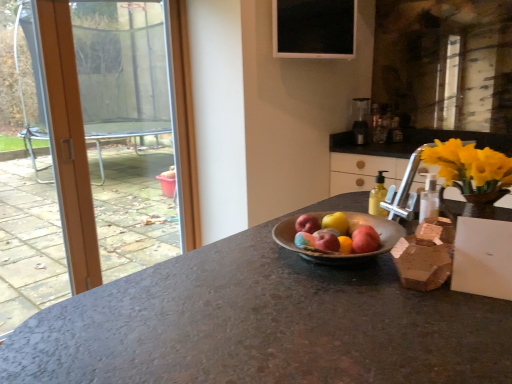
What is the approximate height of transparent glass window at upper left?

transparent glass window at upper left is 1.71 meters tall.

What do you see at coordinates (307, 224) in the screenshot?
I see `matte pink apple at center, acting as the third apple starting from the front` at bounding box center [307, 224].

Locate an element on the screen. Image resolution: width=512 pixels, height=384 pixels. red matte apple at center, which is counted as the second apple, starting from the front is located at coordinates (365, 240).

At what (x,y) coordinates should I click in order to perform the action: click on transparent glass window at upper left. Please return your answer as a coordinate pair (x, y). The image size is (512, 384). Looking at the image, I should click on (114, 134).

From the image's perspective, between matte pink apple at center, the first apple positioned from the front, and red matte apple at center, the 3th apple viewed from the back, who is located below?

matte pink apple at center, the first apple positioned from the front.

Considering the sizes of matte pink apple at center, the 4th apple viewed from the back, and red matte apple at center, which is counted as the second apple, starting from the front, in the image, is matte pink apple at center, the 4th apple viewed from the back, bigger or smaller than red matte apple at center, which is counted as the second apple, starting from the front,?

In the image, matte pink apple at center, the 4th apple viewed from the back, appears to be smaller than red matte apple at center, which is counted as the second apple, starting from the front.

Measure the distance from matte pink apple at center, the first apple positioned from the front, to red matte apple at center, the 3th apple viewed from the back.

The distance of matte pink apple at center, the first apple positioned from the front, from red matte apple at center, the 3th apple viewed from the back, is 6.79 centimeters.

Can you tell me how much orange wood door at left and transparent glass window at upper left differ in facing direction?

The angular difference between orange wood door at left and transparent glass window at upper left is 0.157 degrees.

Is orange wood door at left turned away from transparent glass window at upper left?

→ Yes, transparent glass window at upper left is at the back of orange wood door at left.

Considering the sizes of orange wood door at left and transparent glass window at upper left in the image, is orange wood door at left wider or thinner than transparent glass window at upper left?

In the image, orange wood door at left appears to be more narrow than transparent glass window at upper left.

Measure the distance between orange wood door at left and transparent glass window at upper left.

orange wood door at left is 26.32 inches from transparent glass window at upper left.

Are matte pink apple at center, the first apple positioned from the front, and yellow translucent bottle at right beside each other?

No, matte pink apple at center, the first apple positioned from the front, is not beside yellow translucent bottle at right.

Between point (332, 230) and point (369, 206), which one is positioned behind?

The point (369, 206) is more distant.

What's the angular difference between matte pink apple at center, the 4th apple viewed from the back, and yellow translucent bottle at right's facing directions?

127 degrees.

Considering the relative positions of matte pink apple at center, the first apple positioned from the front, and yellow translucent bottle at right in the image provided, is matte pink apple at center, the first apple positioned from the front, to the left of yellow translucent bottle at right from the viewer's perspective?

Yes, matte pink apple at center, the first apple positioned from the front, is to the left of yellow translucent bottle at right.

From a real-world perspective, is orange wood door at left positioned above or below matte pink apple at center, the 4th apple viewed from the back?

Clearly, from a real-world perspective, orange wood door at left is below matte pink apple at center, the 4th apple viewed from the back.

There is a orange wood door at left. Where is `the 4th apple below it (from the image's perspective)`? The height and width of the screenshot is (384, 512). the 4th apple below it (from the image's perspective) is located at coordinates (327, 241).

Looking at this image, considering the positions of objects orange wood door at left and matte pink apple at center, the first apple positioned from the front, in the image provided, who is more to the right, orange wood door at left or matte pink apple at center, the first apple positioned from the front,?

matte pink apple at center, the first apple positioned from the front, is more to the right.

Which is closer, (38, 30) or (337, 245)?

Point (38, 30).

From the image's perspective, is yellow wood cabinet at upper right under yellow translucent bottle at right?

Incorrect, from the image's perspective, yellow wood cabinet at upper right is higher than yellow translucent bottle at right.

Are yellow wood cabinet at upper right and yellow translucent bottle at right located far from each other?

Indeed, yellow wood cabinet at upper right is not near yellow translucent bottle at right.

Find the location of a particular element. This screenshot has height=384, width=512. bottle behind the yellow wood cabinet at upper right is located at coordinates (378, 196).

Considering the sizes of objects yellow wood cabinet at upper right and yellow translucent bottle at right in the image provided, who is shorter, yellow wood cabinet at upper right or yellow translucent bottle at right?

With less height is yellow translucent bottle at right.

Is point (364, 111) farther from camera compared to point (352, 18)?

Yes, it is behind point (352, 18).

From the image's perspective, between satin silver blender at upper right and black glass window screen at upper center, which one is located above?

black glass window screen at upper center appears higher in the image.

Is black glass window screen at upper center surrounded by satin silver blender at upper right?

No, satin silver blender at upper right does not contain black glass window screen at upper center.

How many degrees apart are the facing directions of red matte apple at center, the 3th apple viewed from the back, and matte pink apple at center, the first apple positioned from the front?

The angular difference between red matte apple at center, the 3th apple viewed from the back, and matte pink apple at center, the first apple positioned from the front, is 1.91 degrees.

Considering the sizes of red matte apple at center, which is counted as the second apple, starting from the front, and matte pink apple at center, the first apple positioned from the front, in the image, is red matte apple at center, which is counted as the second apple, starting from the front, wider or thinner than matte pink apple at center, the first apple positioned from the front,?

Considering their sizes, red matte apple at center, which is counted as the second apple, starting from the front, looks broader than matte pink apple at center, the first apple positioned from the front.

Can you confirm if red matte apple at center, the 3th apple viewed from the back, is bigger than matte pink apple at center, the first apple positioned from the front?

Yes, red matte apple at center, the 3th apple viewed from the back, is bigger than matte pink apple at center, the first apple positioned from the front.

Which object is further away from the camera taking this photo, red matte apple at center, which is counted as the second apple, starting from the front, or matte pink apple at center, the first apple positioned from the front?

red matte apple at center, which is counted as the second apple, starting from the front, is more distant.

I want to click on the 2nd apple to the right of the matte pink apple at center, the 4th apple viewed from the back, starting your count from the anchor, so click(x=365, y=240).

At what (x,y) coordinates should I click in order to perform the action: click on door below the transparent glass window at upper left (from the image's perspective). Please return your answer as a coordinate pair (x, y). The height and width of the screenshot is (384, 512). Looking at the image, I should click on (67, 142).

Estimate the real-world distances between objects in this image. Which object is closer to yellow translucent bottle at right, red matte apple at center, the 3th apple viewed from the back, or yellow wood cabinet at upper right?

red matte apple at center, the 3th apple viewed from the back.

Looking at the image, which one is located further to yellow wood cabinet at upper right, matte pink apple at center, the 4th apple viewed from the back, or black glass window screen at upper center?

The object further to yellow wood cabinet at upper right is matte pink apple at center, the 4th apple viewed from the back.

Consider the image. Based on their spatial positions, is yellow wood cabinet at upper right or yellow translucent bottle at right closer to red matte apple at center, the 1th apple from the back?

Among the two, yellow translucent bottle at right is located nearer to red matte apple at center, the 1th apple from the back.

Which object lies further to the anchor point black glass window screen at upper center, yellow translucent bottle at right or yellow wood cabinet at upper right?

yellow translucent bottle at right is further to black glass window screen at upper center.

Estimate the real-world distances between objects in this image. Which object is closer to yellow translucent bottle at right, transparent glass window at upper left or matte pink apple at center, which appears as the 2th apple when viewed from the back?

matte pink apple at center, which appears as the 2th apple when viewed from the back.

When comparing their distances from satin silver blender at upper right, does orange wood door at left or red matte apple at center, the 3th apple viewed from the back, seem closer?

orange wood door at left.

Looking at the image, which one is located further to yellow translucent bottle at right, yellow wood cabinet at upper right or red matte apple at center, the 3th apple viewed from the back?

Based on the image, yellow wood cabinet at upper right appears to be further to yellow translucent bottle at right.

Estimate the real-world distances between objects in this image. Which object is closer to matte pink apple at center, which appears as the 2th apple when viewed from the back, orange wood door at left or satin silver blender at upper right?

orange wood door at left is closer to matte pink apple at center, which appears as the 2th apple when viewed from the back.

The image size is (512, 384). I want to click on window positioned between red matte apple at center, arranged as the 4th apple when viewed from the front, and satin silver blender at upper right from near to far, so (x=114, y=134).

Where is `window screen between transparent glass window at upper left and yellow translucent bottle at right`? The image size is (512, 384). window screen between transparent glass window at upper left and yellow translucent bottle at right is located at coordinates (314, 28).

Find the location of a particular element. The height and width of the screenshot is (384, 512). window screen between orange wood door at left and satin silver blender at upper right from left to right is located at coordinates (314, 28).

The width and height of the screenshot is (512, 384). Identify the location of apple between red matte apple at center, the 1th apple from the back, and yellow wood cabinet at upper right, in the horizontal direction. (365, 240).